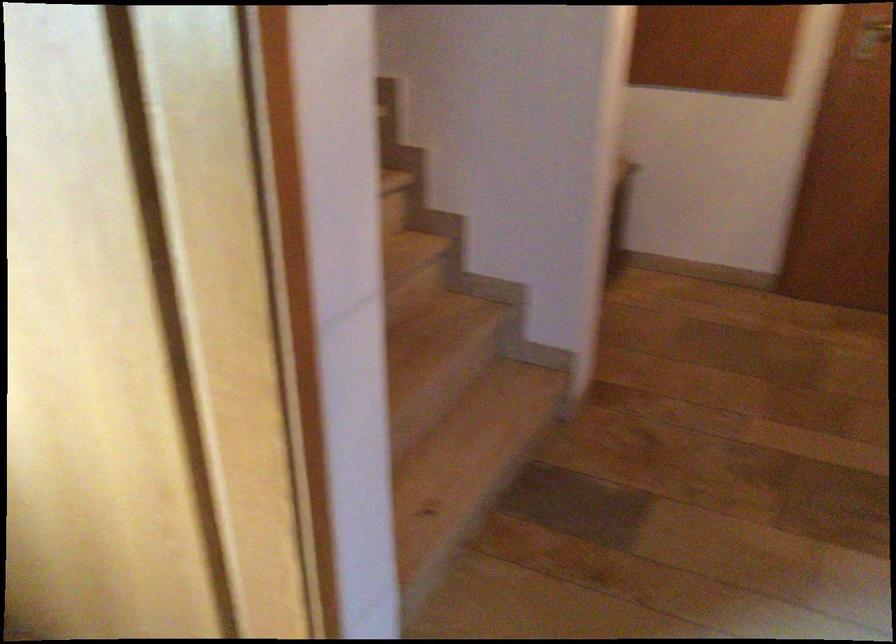
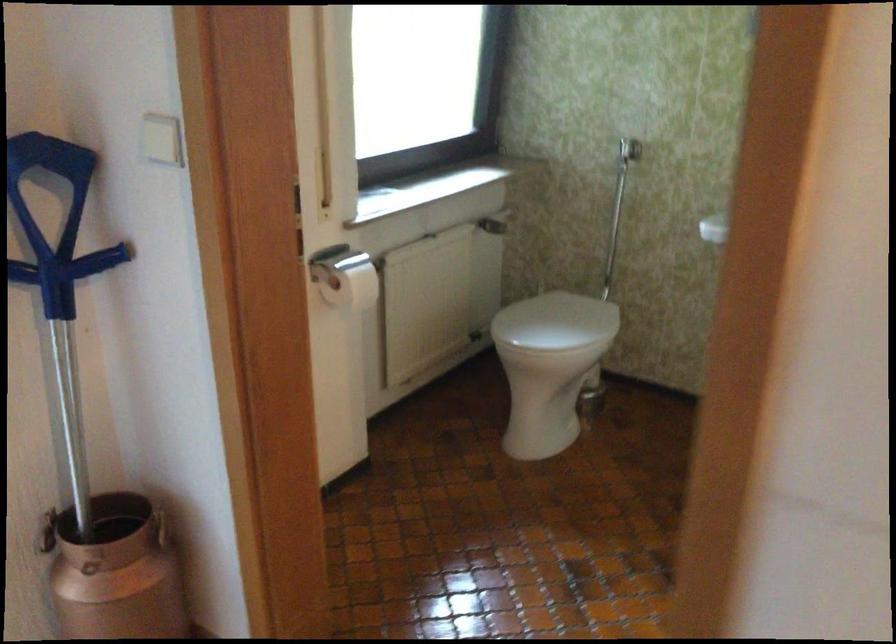
The first image is from the beginning of the video and the second image is from the end. How did the camera likely rotate when shooting the video?

The rotation direction of the camera is left-down.